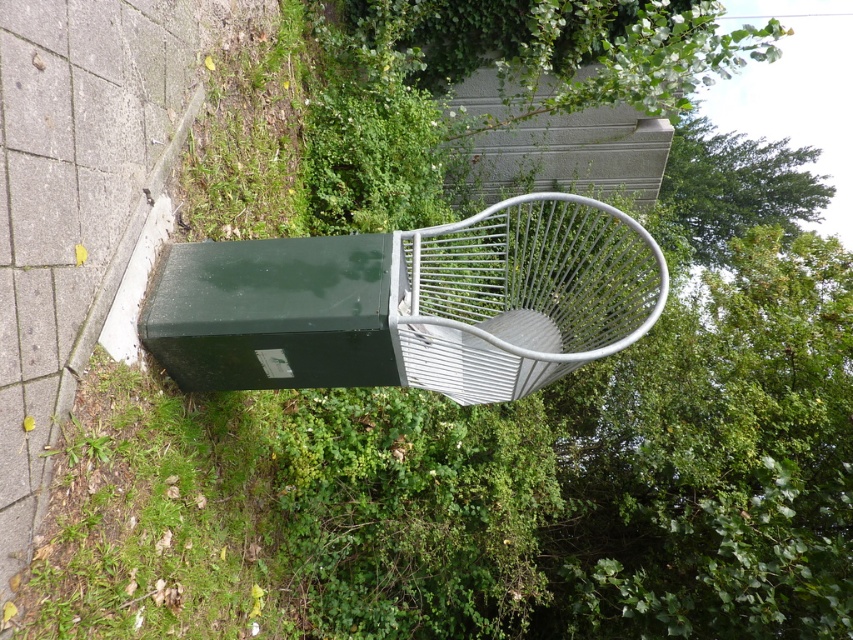
You are standing at the point marked by coordinates point (546, 49) in the image. Looking around, you see the green utility box mounted on a concrete base and the metal chair attached to it. Which object is closer to your current position?

The point (546, 49) corresponds to the green leafy tree at upper center, so the green utility box mounted on a concrete base and the metal chair attached to it are farther away from your current position.

You are standing at the center of the image and want to step onto the green grass at lower left. What direction should you move in to reach it?

To reach the green grass at lower left from the center of the image, you should move towards the lower left direction since that is where the green grass at lower left is located.